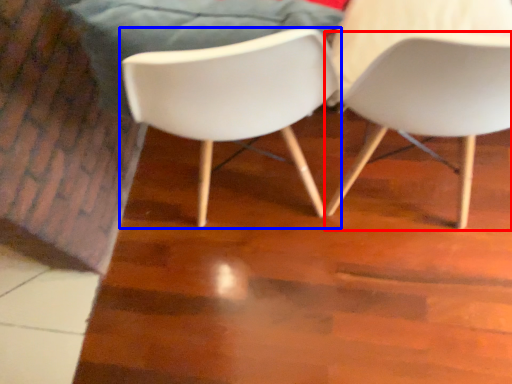
Question: Which of the following is the farthest to the observer, chair (highlighted by a red box) or chair (highlighted by a blue box)?

Choices:
 (A) chair
 (B) chair

Answer: (B)